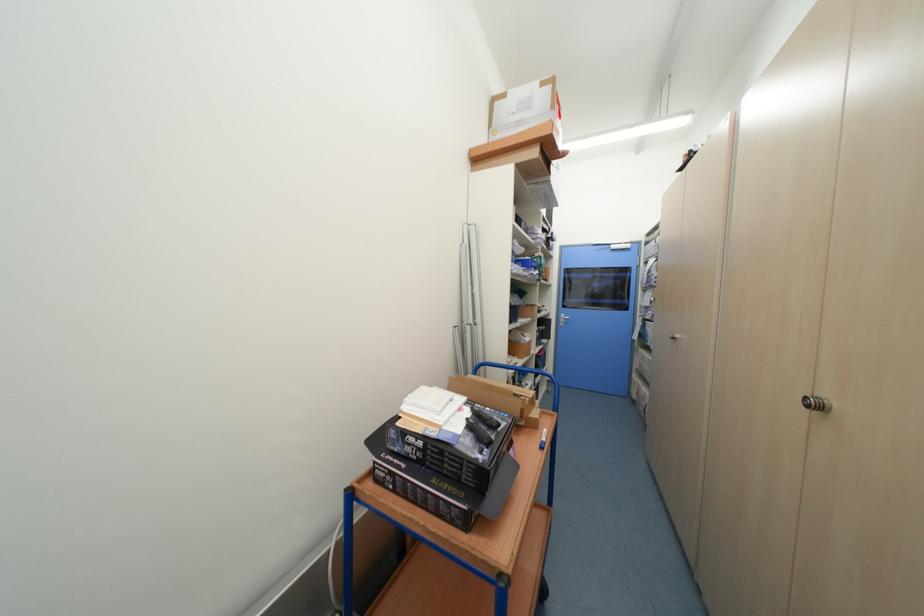
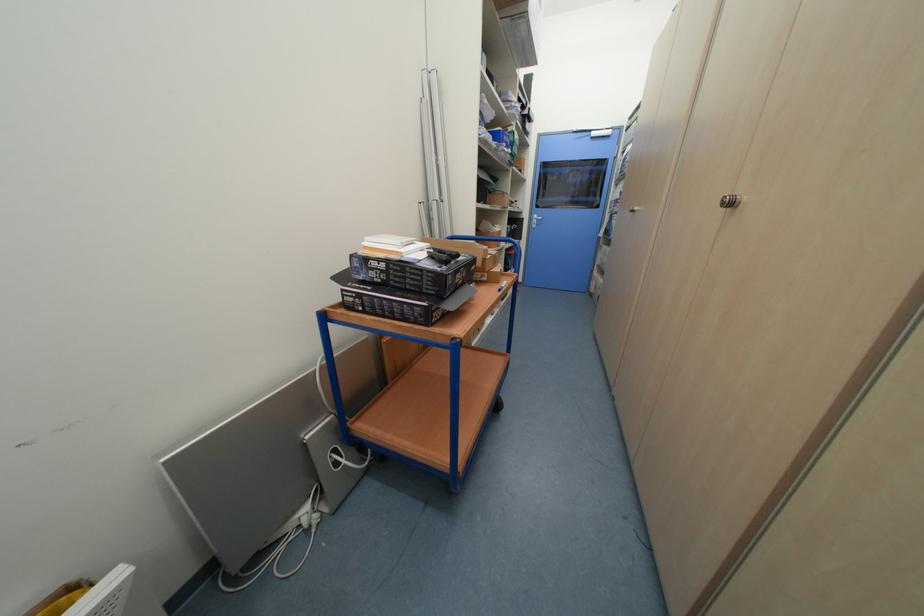
Find the pixel in the second image that matches pixel 448 463 in the first image.

(410, 278)